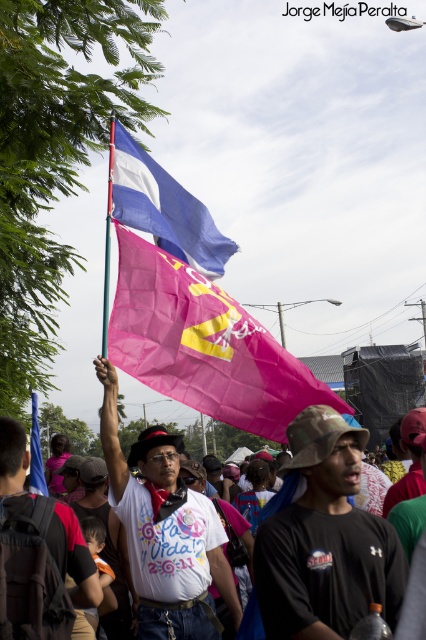
Who is more distant from viewer, (330, 448) or (97, 600)?

Point (330, 448)

Does black matte shirt at center appear on the right side of white t-shirt at center?

Yes, black matte shirt at center is to the right of white t-shirt at center.

Describe the element at coordinates (325, 540) in the screenshot. I see `black matte shirt at center` at that location.

Locate an element on the screen. black matte shirt at center is located at coordinates (325, 540).

Is white matte t-shirt at center in front of blue fabric flag at upper left?

That is True.

Is point (181, 576) positioned before point (40, 474)?

Yes.

Where is `white matte t-shirt at center`? white matte t-shirt at center is located at coordinates (164, 531).

Looking at this image, can you confirm if white matte t-shirt at center is smaller than blue fabric flag at upper center?

Yes, white matte t-shirt at center is smaller than blue fabric flag at upper center.

Who is shorter, white matte t-shirt at center or blue fabric flag at upper center?

Standing shorter between the two is white matte t-shirt at center.

Between point (143, 472) and point (126, 172), which one is positioned behind?

The point (143, 472) is more distant.

Image resolution: width=426 pixels, height=640 pixels. Find the location of `white matte t-shirt at center`. white matte t-shirt at center is located at coordinates (164, 531).